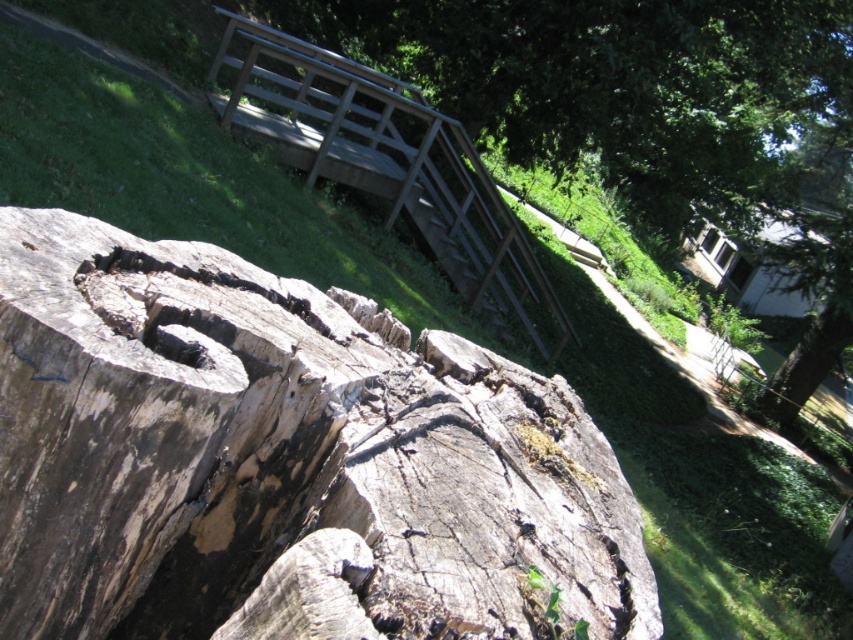
You are standing at the center of the wooden bridge and want to reach the wooden rail at upper center. Which direction should you move to get there?

You should move north to reach the wooden rail at upper center since it is located at point (387, 161), which is north of your current position at the center of the wooden bridge.

You are a painter setting up your easel to paint the wooden rail at upper center and the smooth brown tree trunk at upper right. You need to ensure your painting accurately represents their widths. Based on the scene, which object is wider?

The smooth brown tree trunk at upper right is wider than the wooden rail at upper center.

You are a painter setting up your easel to paint the wooden rail at upper center and the smooth brown tree trunk at upper right. You want to ensure your painting accurately reflects their relative sizes. Based on the scene, which object should you depict as larger in your artwork?

The smooth brown tree trunk at upper right should be depicted as larger in the artwork since the wooden rail at upper center has a smaller size compared to it.